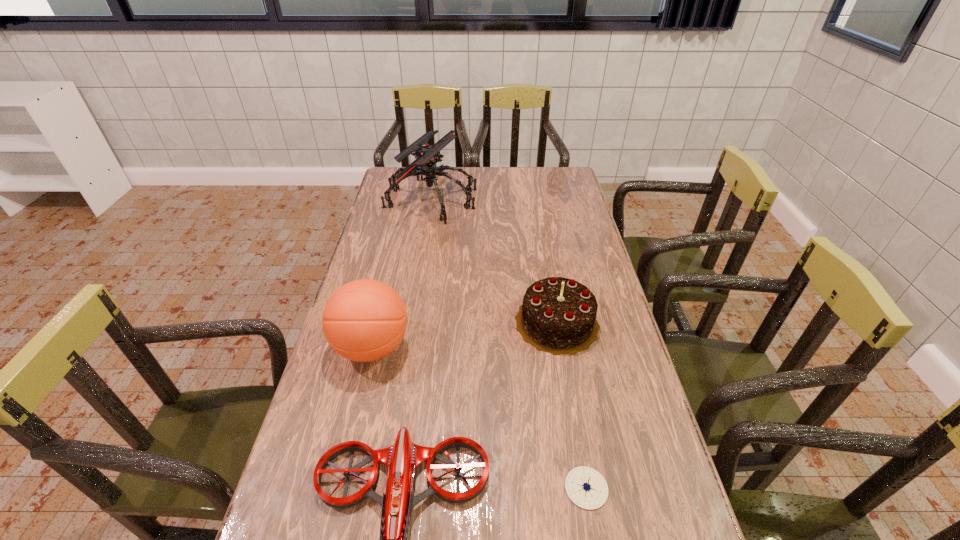
This screenshot has height=540, width=960. Find the location of `drone located at the left edge`. drone located at the left edge is located at coordinates (427, 156).

This screenshot has width=960, height=540. In order to click on basketball that is positioned at the left edge in this screenshot , I will do `click(364, 320)`.

Identify the location of birthday cake located in the right edge section of the desktop. (558, 315).

Locate an element on the screen. compass that is at the right edge is located at coordinates (586, 487).

Where is `object present at the far left corner`? object present at the far left corner is located at coordinates (427, 156).

The image size is (960, 540). I want to click on free spot at the far edge of the desktop, so click(x=483, y=167).

The height and width of the screenshot is (540, 960). In order to click on free space at the left edge of the desktop in this screenshot , I will do [x=308, y=453].

The width and height of the screenshot is (960, 540). I want to click on free point at the right edge, so click(x=548, y=221).

What are the coordinates of `empty space between the third shortest object and the shortest object` in the screenshot? It's located at (571, 405).

Identify the location of vacant space that is in between the compass and the third tallest object. (571, 405).